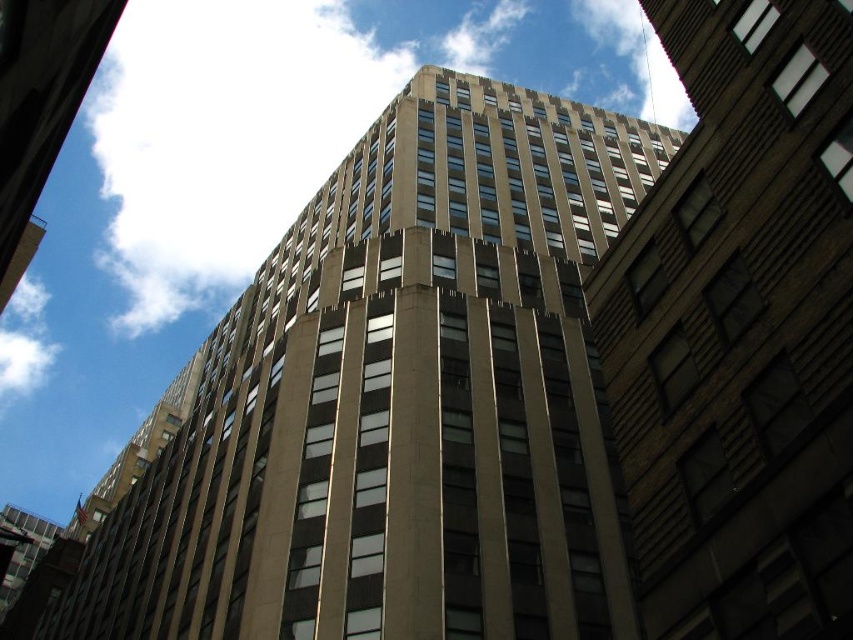
Looking at this image, you are standing in front of a tall modern building. You want to take a photo of the brown stone building at center. Where should you position your camera to capture it in the frame?

The brown stone building at center is located at the 2D coordinates point (740, 330), so you should position your camera to aim towards the center of the frame slightly towards the upper part to capture it.

You are standing in front of a tall building and looking up at the sky. You notice the brown stone building at center and the white fluffy cloud at upper center. Which one appears narrower from your perspective?

The brown stone building at center appears narrower than the white fluffy cloud at upper center because it has a lesser width compared to it.

You are an architect evaluating two buildings in the city. You notice the beige concrete building at center and the brown stone building at center. Which one would you recommend for a client who wants a more imposing structure?

The beige concrete building at center is larger in size than the brown stone building at center, so it would be the better choice for a client seeking an imposing structure due to its greater size.